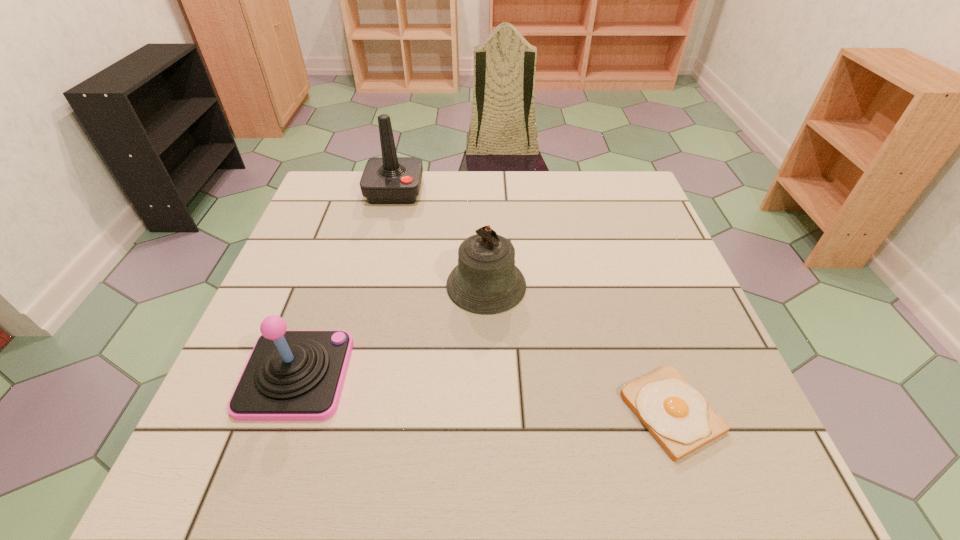
Find the location of a particular element. This screenshot has width=960, height=540. free location located on the back of the rightmost object is located at coordinates (619, 259).

The width and height of the screenshot is (960, 540). What are the coordinates of `object positioned at the far edge` in the screenshot? It's located at (389, 179).

At what (x,y) coordinates should I click in order to perform the action: click on object situated at the near edge. Please return your answer as a coordinate pair (x, y). The width and height of the screenshot is (960, 540). Looking at the image, I should click on (678, 416).

Locate an element on the screen. Image resolution: width=960 pixels, height=540 pixels. object that is at the right edge is located at coordinates (678, 416).

This screenshot has width=960, height=540. I want to click on object situated at the far left corner, so click(389, 179).

At what (x,y) coordinates should I click in order to perform the action: click on object that is at the near right corner. Please return your answer as a coordinate pair (x, y). Looking at the image, I should click on (678, 416).

In the image, there is a desktop. At what (x,y) coordinates should I click in order to perform the action: click on free space at the far edge. Please return your answer as a coordinate pair (x, y). Looking at the image, I should click on (523, 199).

Find the location of `free space at the near edge of the desktop`. free space at the near edge of the desktop is located at coordinates (606, 489).

This screenshot has height=540, width=960. In order to click on vacant region at the left edge of the desktop in this screenshot , I will do `click(218, 398)`.

Find the location of `free space at the right edge`. free space at the right edge is located at coordinates (647, 252).